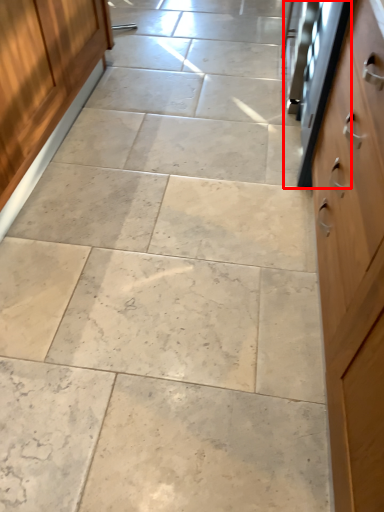
Question: Where is oven (annotated by the red box) located in relation to cabinetry in the image?

Choices:
 (A) right
 (B) left

Answer: (A)